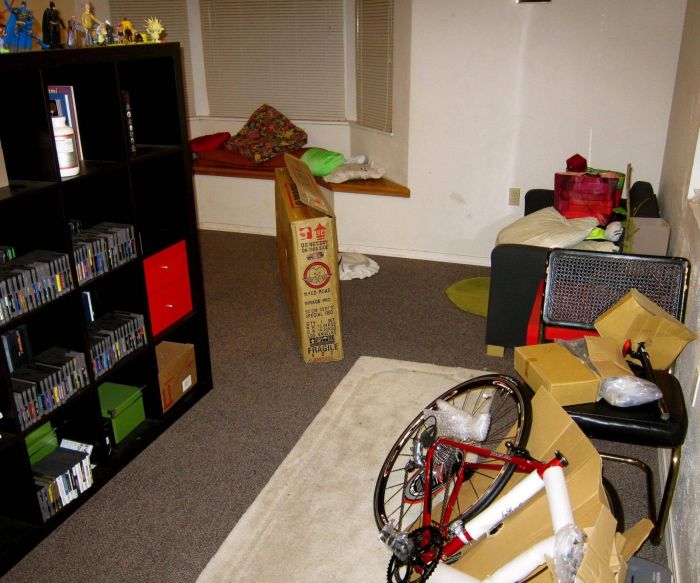
Where is `flowered cushion`? Image resolution: width=700 pixels, height=583 pixels. flowered cushion is located at coordinates 262,135.